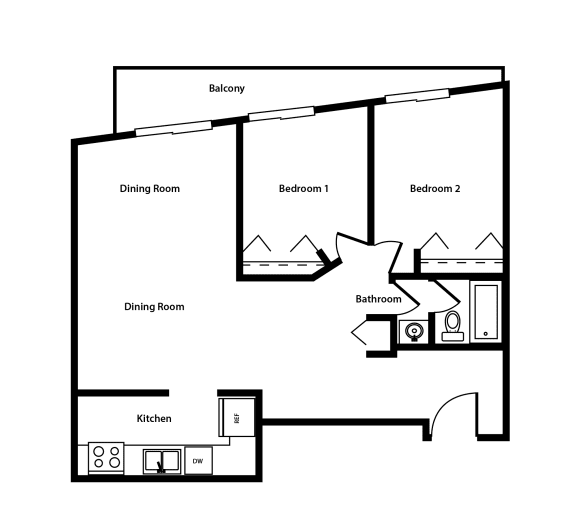
Find the location of a particular element. This screenshot has width=576, height=518. bedroom is located at coordinates (320, 141).